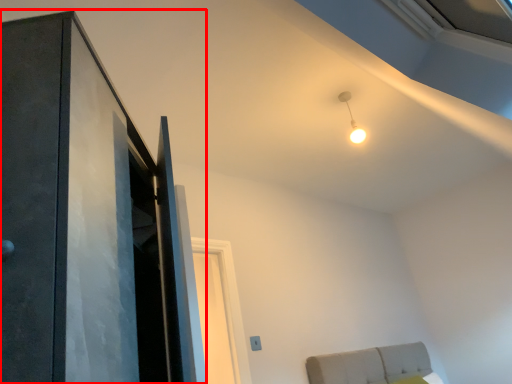
Question: From the image's perspective, considering the relative positions of door (annotated by the red box) and light in the image provided, where is door (annotated by the red box) located with respect to the staircase?

Choices:
 (A) above
 (B) below

Answer: (B)